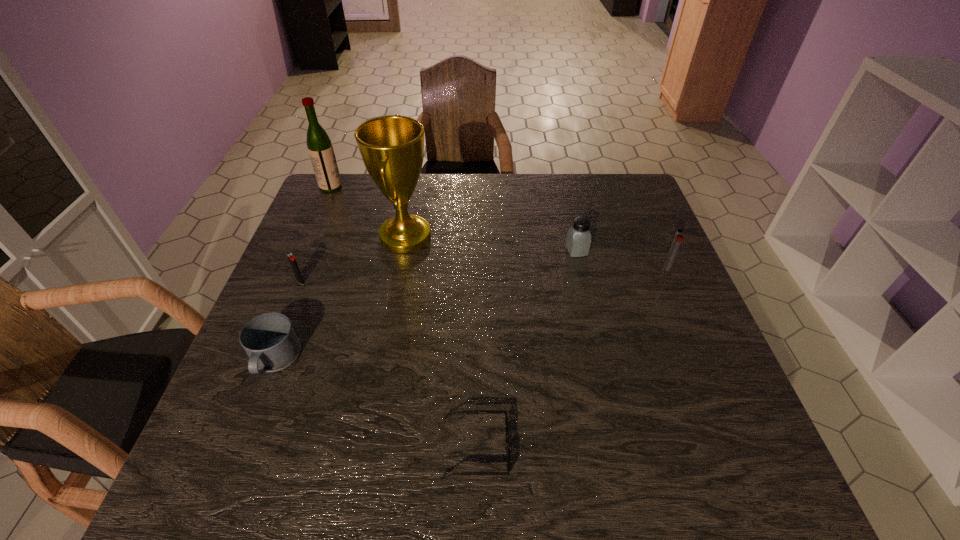
Locate an element on the screen. vacant space at the far left corner of the desktop is located at coordinates (346, 204).

In the image, there is a desktop. Where is `vacant region at the far right corner`? The height and width of the screenshot is (540, 960). vacant region at the far right corner is located at coordinates (617, 204).

Find the location of a particular element. This screenshot has width=960, height=540. free spot between the nearer igniter and the saltshaker is located at coordinates (439, 266).

The width and height of the screenshot is (960, 540). Find the location of `free point between the farthest object and the nearer igniter`. free point between the farthest object and the nearer igniter is located at coordinates (316, 234).

This screenshot has width=960, height=540. In order to click on free space between the fourth object from left to right and the second object from right to left in this screenshot , I will do `click(491, 244)`.

In order to click on free point between the mug and the fourth object from left to right in this screenshot , I will do `click(340, 299)`.

I want to click on vacant space that's between the mug and the right igniter, so click(470, 314).

I want to click on unoccupied position between the third nearest object and the farthest object, so click(316, 234).

Where is `vacant point located between the sunglasses and the sixth farthest object`? This screenshot has height=540, width=960. vacant point located between the sunglasses and the sixth farthest object is located at coordinates (375, 405).

At what (x,y) coordinates should I click in order to perform the action: click on vacant area that lies between the second shortest object and the award. Please return your answer as a coordinate pair (x, y). Image resolution: width=960 pixels, height=540 pixels. Looking at the image, I should click on pyautogui.click(x=340, y=299).